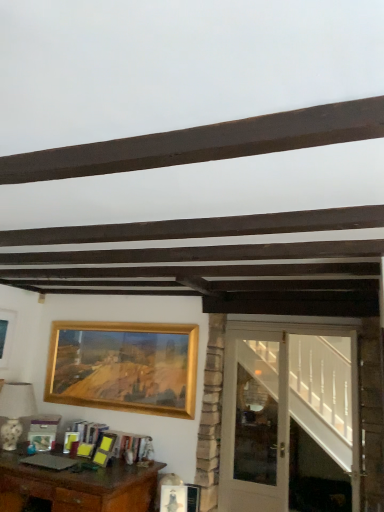
Question: Would you say brown wooden desk at lower left is to the left or to the right of gold metallic picture frame at upper left, the second picture frame in the right-to-left sequence, in the picture?

Choices:
 (A) left
 (B) right

Answer: (B)

Question: From a real-world perspective, is brown wooden desk at lower left positioned above or below gold metallic picture frame at upper left, which ranks as the first picture frame in left-to-right order?

Choices:
 (A) above
 (B) below

Answer: (B)

Question: Which is nearer to the white glossy lampshade at left?

Choices:
 (A) gold metallic picture frame at upper center, which is the 1th picture frame in right-to-left order
 (B) white glossy door at right
 (C) gold metallic picture frame at upper left, which ranks as the first picture frame in left-to-right order
 (D) white glass door at right
 (E) brown wooden desk at lower left

Answer: (C)

Question: Estimate the real-world distances between objects in this image. Which object is closer to the white glass door at right?

Choices:
 (A) gold metallic picture frame at upper left, which ranks as the first picture frame in left-to-right order
 (B) white glossy door at right
 (C) gold metallic picture frame at upper center, which is the 1th picture frame in right-to-left order
 (D) white glossy lampshade at left
 (E) brown wooden desk at lower left

Answer: (B)